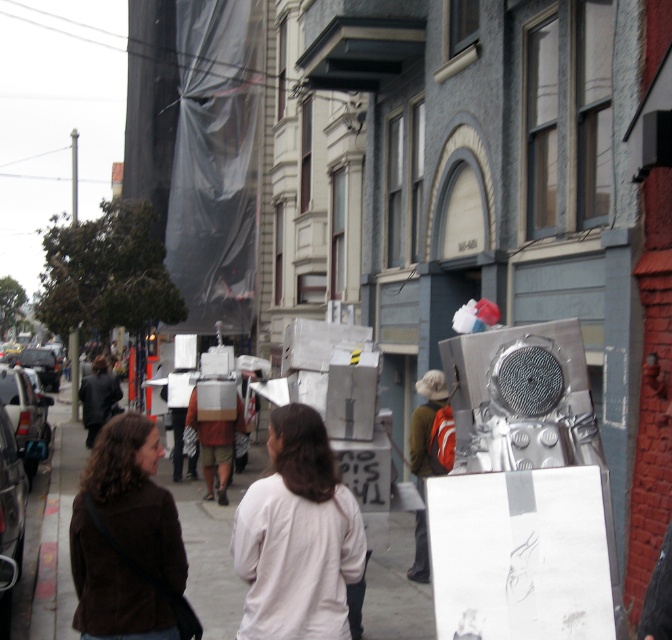
Question: Which object appears closest to the camera in this image?

Choices:
 (A) suede brown jacket at lower left
 (B) white matte shirt at center

Answer: (B)

Question: Can you confirm if white matte shirt at center is bigger than suede brown jacket at lower left?

Choices:
 (A) no
 (B) yes

Answer: (B)

Question: Does smooth concrete sidewalk at center appear on the left side of suede brown jacket at lower left?

Choices:
 (A) yes
 (B) no

Answer: (A)

Question: Which object is positioned farthest from the suede brown jacket at lower left?

Choices:
 (A) white matte shirt at center
 (B) smooth concrete sidewalk at center
 (C) metallic silver backpack at center

Answer: (B)

Question: Which object is positioned farthest from the white matte shirt at center?

Choices:
 (A) metallic silver backpack at center
 (B) suede brown jacket at lower left

Answer: (A)

Question: Does smooth concrete sidewalk at center appear on the left side of white matte shirt at center?

Choices:
 (A) yes
 (B) no

Answer: (A)